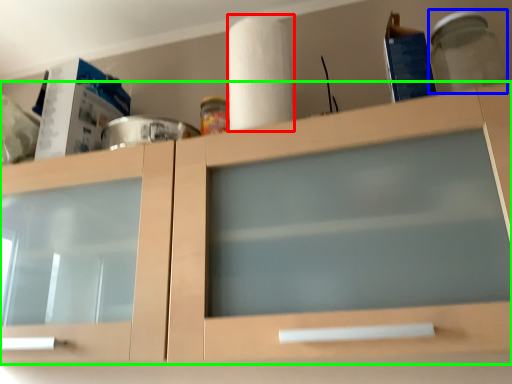
Question: Based on their relative distances, which object is nearer to paper towel (highlighted by a red box)? Choose from glass jar (highlighted by a blue box) and cabinetry (highlighted by a green box).

Choices:
 (A) glass jar
 (B) cabinetry

Answer: (B)